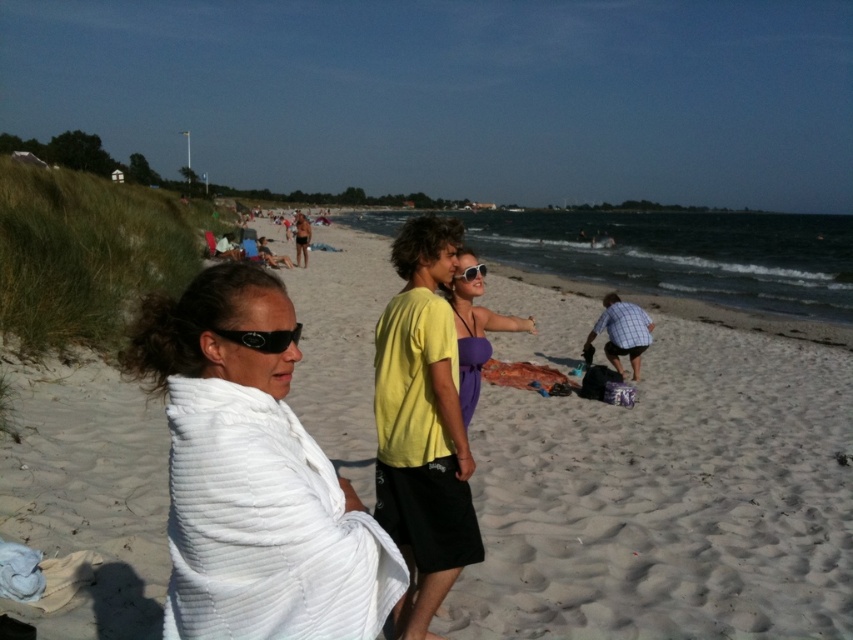
From the picture: You are standing at the center of the beach scene. You want to locate the white terry towel at left. In which direction should you look relative to your position?

The white terry towel at left is located at point (252, 477), so you should look to the left relative to your position at the center of the beach scene.

You are standing at the point with coordinates (252,477) in the beach scene. What object are you standing on?

You are standing on the white terry towel at left.

You are a photographer trying to capture a wide shot of the beach scene. You need to ensure that both the white terry towel at left and the matte yellow shirt at center are fully visible in the frame. Given their sizes, which object might require you to adjust your camera angle to include it properly?

The matte yellow shirt at center requires adjusting the camera angle because it is wider than the white terry towel at left, so it might be harder to fit into the frame if it is larger.